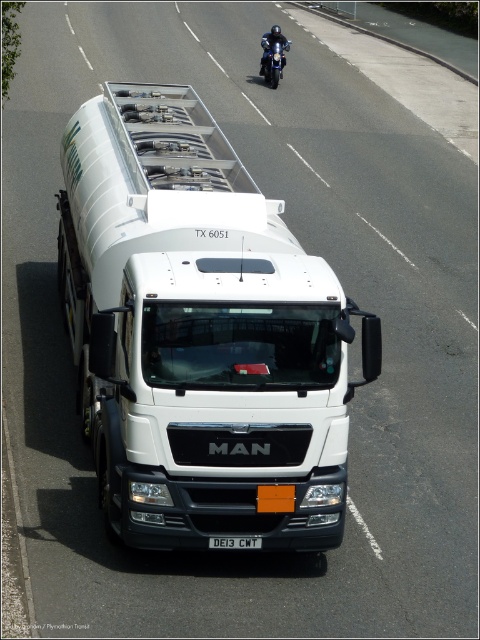
Can you confirm if white glossy tanker at center is positioned above white plastic license plate at center?

Indeed, white glossy tanker at center is positioned over white plastic license plate at center.

You are a GUI agent. You are given a task and a screenshot of the screen. Output one action in this format:
    pyautogui.click(x=<x>, y=<y>)
    Task: Click on the white glossy tanker at center
    Image resolution: width=480 pixels, height=640 pixels.
    Given the screenshot: What is the action you would take?
    pyautogui.click(x=200, y=333)

This screenshot has height=640, width=480. I want to click on white glossy tanker at center, so click(x=200, y=333).

Which is more to the right, white glossy tanker at center or shiny blue motorcycle at upper center?

shiny blue motorcycle at upper center is more to the right.

Who is more distant from viewer, (239, 499) or (262, 36)?

The point (262, 36) is more distant.

Find the location of `white glossy tanker at center`. white glossy tanker at center is located at coordinates [x=200, y=333].

In the scene shown: Can you confirm if white plastic license plate at center is taller than shiny blue motorcycle at upper center?

In fact, white plastic license plate at center may be shorter than shiny blue motorcycle at upper center.

Is point (211, 541) more distant than point (278, 28)?

No, it is in front of (278, 28).

This screenshot has height=640, width=480. I want to click on white plastic license plate at center, so click(236, 541).